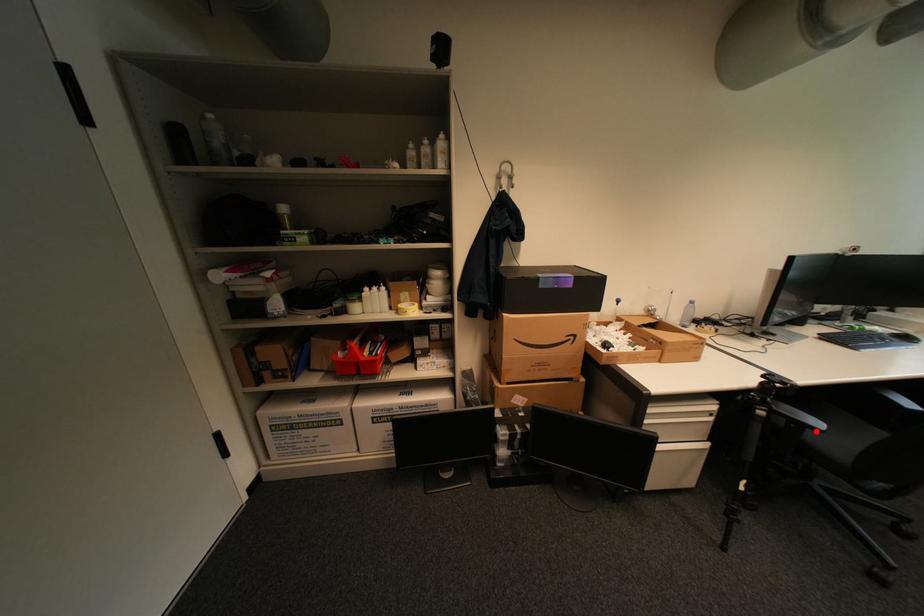
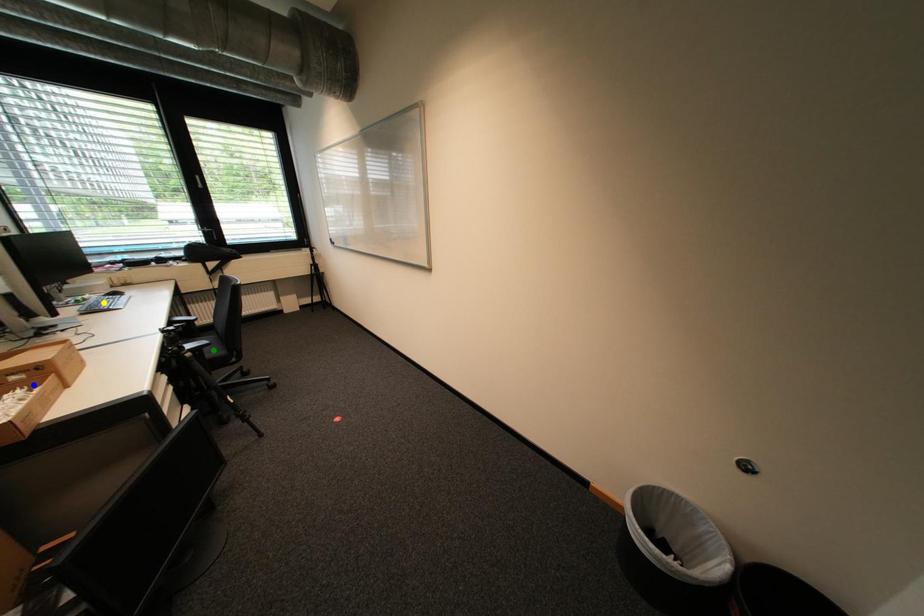
Question: I am providing you with two images of the same scene from different viewpoints. A red point is marked on the first image. You are given multiple points on the second image. Which point in image 2 is actually the same real-world point as the red point in image 1?

Choices:
 (A) blue point
 (B) yellow point
 (C) green point

Answer: (C)